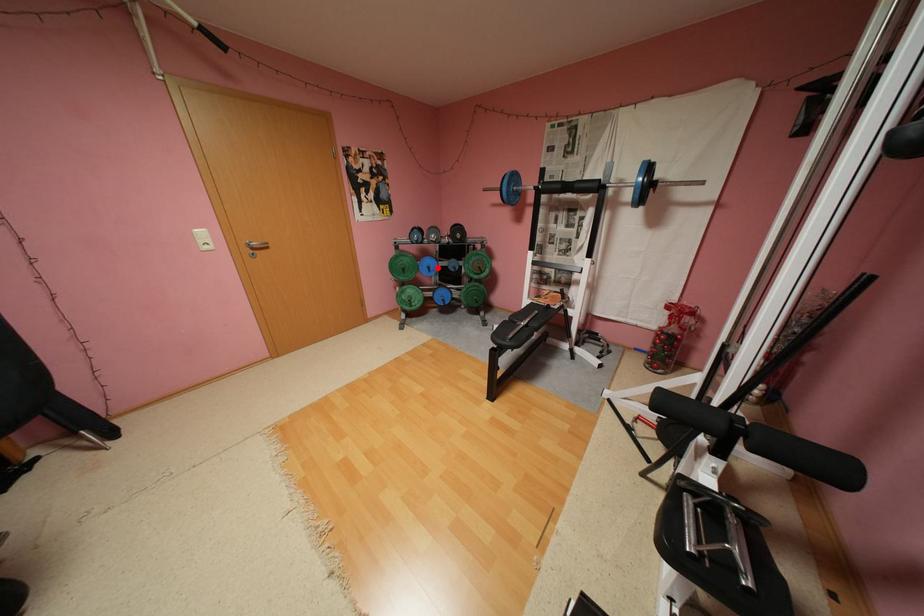
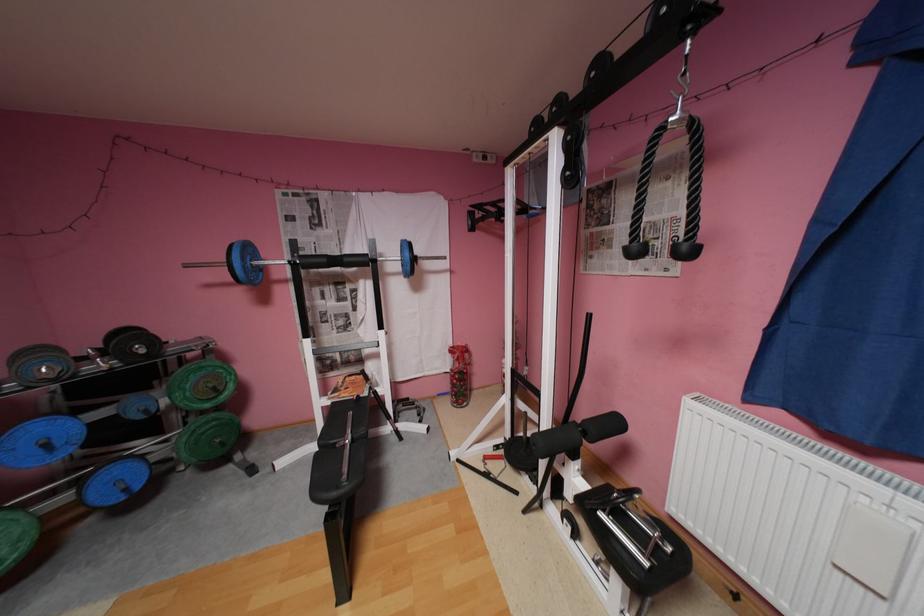
The point at the highlighted location is marked in the first image. Where is the corresponding point in the second image?

(55, 445)